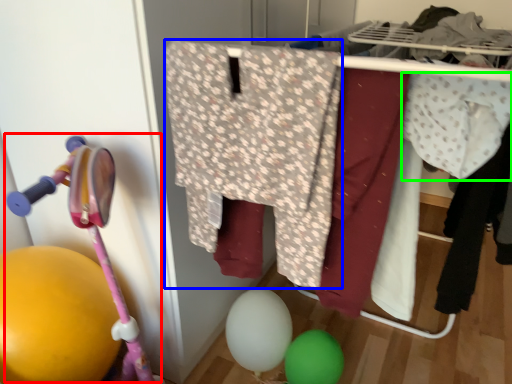
Question: Based on their relative distances, which object is nearer to baby carriage (highlighted by a red box)? Choose from clothing (highlighted by a blue box) and clothing (highlighted by a green box).

Choices:
 (A) clothing
 (B) clothing

Answer: (A)